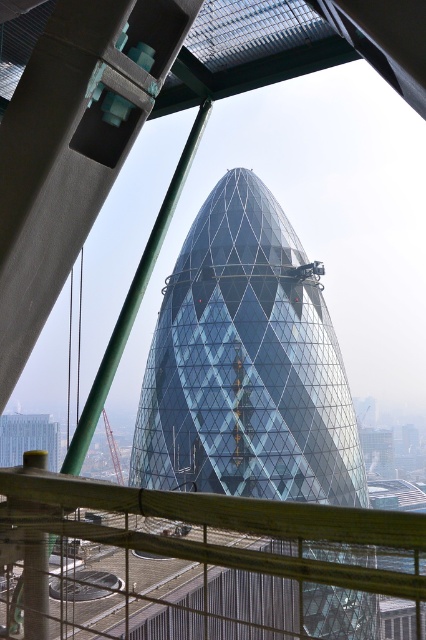
Which is more to the right, wooden rail at center or transparent glass tower at center?

wooden rail at center is more to the right.

Consider the image. Can you confirm if wooden rail at center is smaller than transparent glass tower at center?

Correct, wooden rail at center occupies less space than transparent glass tower at center.

Does point (213, 573) lie in front of point (264, 282)?

Yes, point (213, 573) is in front of point (264, 282).

At what (x,y) coordinates should I click in order to perform the action: click on wooden rail at center. Please return your answer as a coordinate pair (x, y). Looking at the image, I should click on (198, 564).